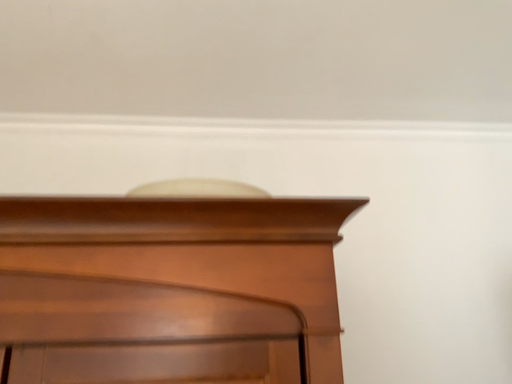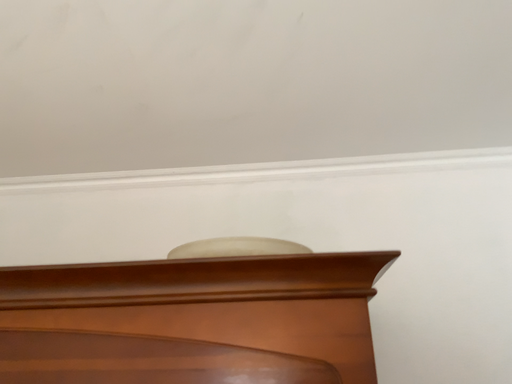
Question: How did the camera likely rotate when shooting the video?

Choices:
 (A) rotated right
 (B) rotated left

Answer: (B)